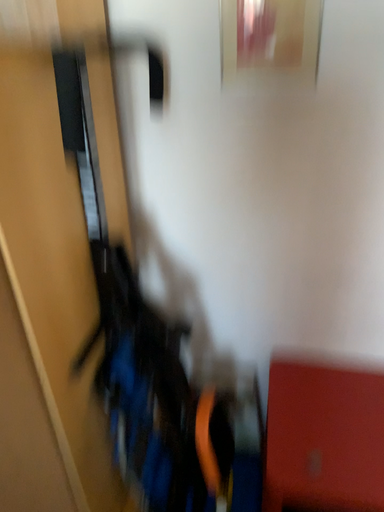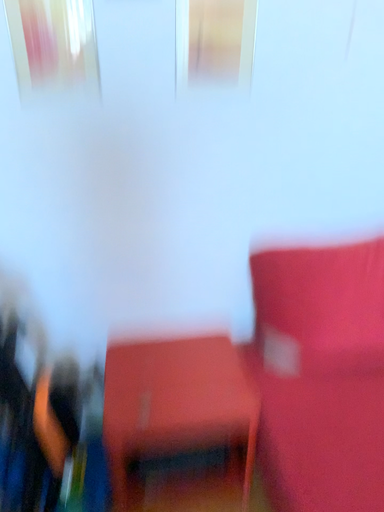
Question: Which way did the camera rotate in the video?

Choices:
 (A) rotated right
 (B) rotated left

Answer: (A)